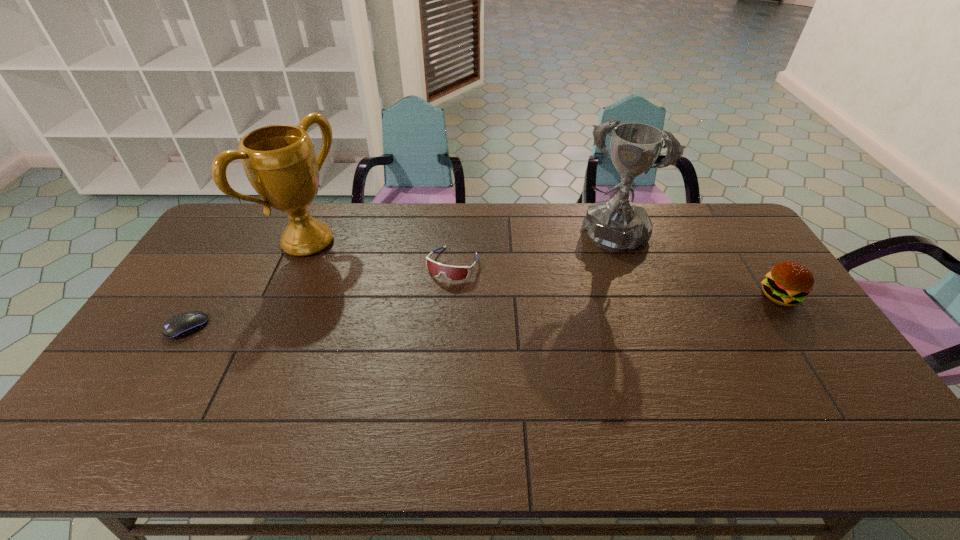
Image resolution: width=960 pixels, height=540 pixels. Find the location of `vacant space on the desktop that is between the shortest object and the hamburger and is positioned on the side with emblem of the right award`. vacant space on the desktop that is between the shortest object and the hamburger and is positioned on the side with emblem of the right award is located at coordinates (568, 308).

Locate an element on the screen. Image resolution: width=960 pixels, height=540 pixels. vacant spot on the desktop that is between the leftmost object and the hamburger and is positioned on the front-facing side of the goggles is located at coordinates (423, 315).

Locate an element on the screen. The height and width of the screenshot is (540, 960). free space on the desktop that is between the nearest object and the rightmost object and is positioned on the front of the fourth object from right to left with the decoration is located at coordinates (438, 314).